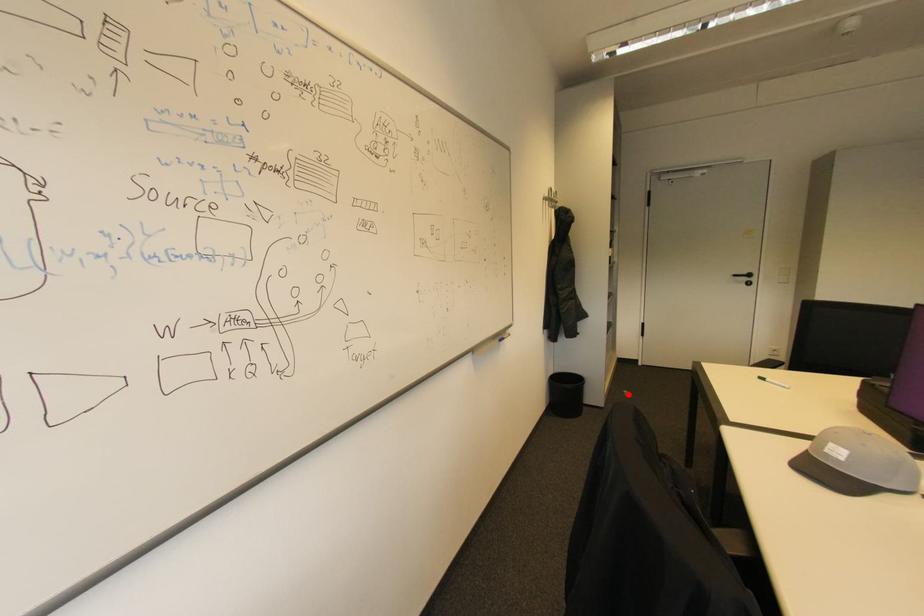
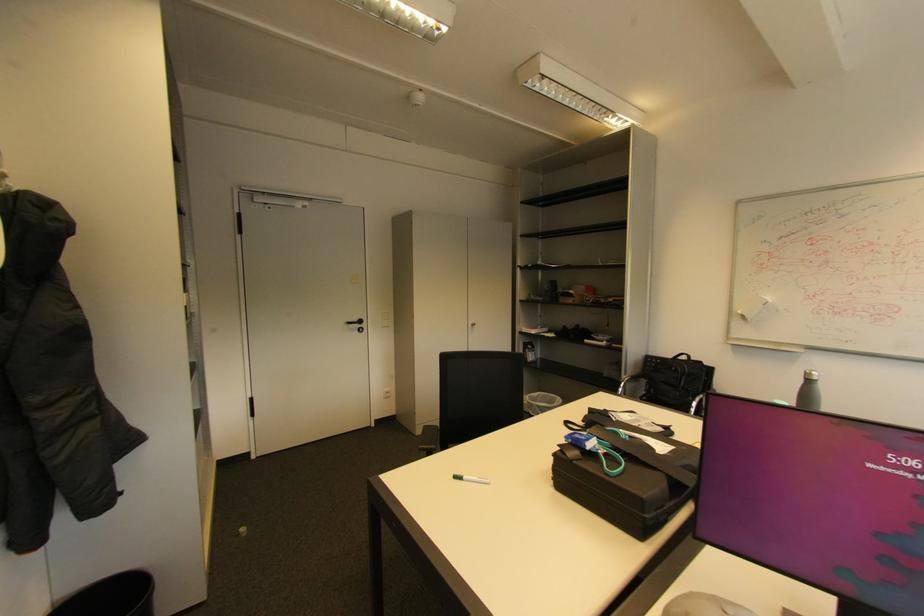
Question: I am providing you with two images of the same scene from different viewpoints. A red point is shown in image1. For the corresponding object point in image2, is it positioned nearer or farther from the camera?

Choices:
 (A) Nearer
 (B) Farther

Answer: (A)